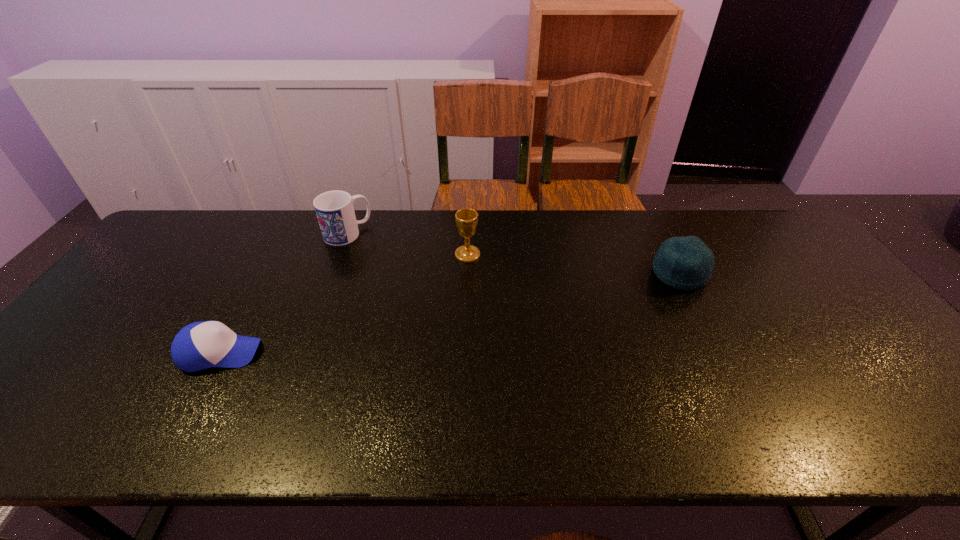
What are the coordinates of `vacant region that satisfies the following two spatial constraints: 1. on the front side of the third object from right to left; 2. on the front-facing side of the nearest object` in the screenshot? It's located at 302,353.

Find the location of a particular element. This screenshot has height=540, width=960. vacant space that satisfies the following two spatial constraints: 1. on the front side of the rightmost object; 2. on the left side of the mug is located at coordinates (332, 273).

Where is `free space that satisfies the following two spatial constraints: 1. on the front side of the chalice; 2. on the right side of the farthest object`? The width and height of the screenshot is (960, 540). free space that satisfies the following two spatial constraints: 1. on the front side of the chalice; 2. on the right side of the farthest object is located at coordinates (340, 255).

Locate an element on the screen. free region that satisfies the following two spatial constraints: 1. on the front side of the rightmost object; 2. on the left side of the farthest object is located at coordinates (332, 273).